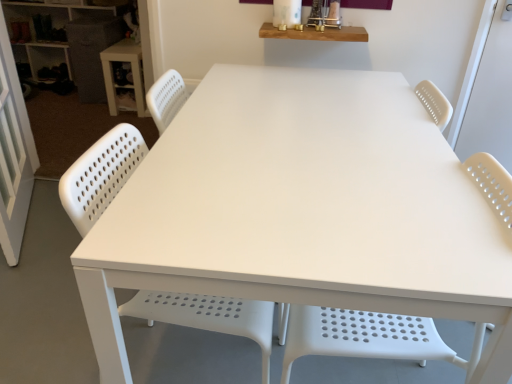
The image size is (512, 384). What do you see at coordinates (132, 74) in the screenshot?
I see `white plastic table at upper left` at bounding box center [132, 74].

The height and width of the screenshot is (384, 512). Describe the element at coordinates (208, 316) in the screenshot. I see `white perforated plastic chair at lower left, the 1th chair from the left` at that location.

This screenshot has width=512, height=384. I want to click on white perforated plastic chair at center, which is the 1th chair from right to left, so click(369, 337).

Image resolution: width=512 pixels, height=384 pixels. In order to click on matte white shelves at upper left in this screenshot , I will do `click(68, 40)`.

Would you say matte white shelves at upper left is a long distance from white plastic table at upper left?

No, there isn't a large distance between matte white shelves at upper left and white plastic table at upper left.

Consider the image. Measure the distance from matte white shelves at upper left to white plastic table at upper left.

A distance of 19.69 inches exists between matte white shelves at upper left and white plastic table at upper left.

From the image's perspective, relative to white plastic table at upper left, is matte white shelves at upper left above or below?

matte white shelves at upper left is situated higher than white plastic table at upper left in the image.

Considering the relative sizes of matte white shelves at upper left and white plastic table at upper left in the image provided, is matte white shelves at upper left shorter than white plastic table at upper left?

In fact, matte white shelves at upper left may be taller than white plastic table at upper left.

Is white plastic table at upper left situated inside white perforated plastic chair at lower left, which is the second chair in right-to-left order, or outside?

white plastic table at upper left is spatially situated outside white perforated plastic chair at lower left, which is the second chair in right-to-left order.

Can you confirm if white plastic table at upper left is smaller than white perforated plastic chair at lower left, which is the second chair in right-to-left order?

Indeed, white plastic table at upper left has a smaller size compared to white perforated plastic chair at lower left, which is the second chair in right-to-left order.

Is white plastic table at upper left looking in the opposite direction of white perforated plastic chair at lower left, the 1th chair from the left?

No.

Who is shorter, white plastic table at upper left or white perforated plastic chair at lower left, the 1th chair from the left?

With less height is white plastic table at upper left.

Which of these two, white plastic table at upper left or white perforated plastic chair at center, which is the 1th chair from right to left, is thinner?

white plastic table at upper left.

How different are the orientations of white plastic table at upper left and white perforated plastic chair at center, which is the 1th chair from right to left, in degrees?

The facing directions of white plastic table at upper left and white perforated plastic chair at center, which is the 1th chair from right to left, are 0.638 degrees apart.

There is a white plastic table at upper left. Identify the location of the 2nd chair above it (from a real-world perspective). This screenshot has height=384, width=512. (369, 337).

Is white perforated plastic chair at center, the 2th chair in the left-to-right sequence, at the back of white plastic table at upper left?

white plastic table at upper left is not turned away from white perforated plastic chair at center, the 2th chair in the left-to-right sequence.

Is matte white shelves at upper left oriented away from white perforated plastic chair at lower left, which is the second chair in right-to-left order?

matte white shelves at upper left is not turned away from white perforated plastic chair at lower left, which is the second chair in right-to-left order.

Can you confirm if matte white shelves at upper left is thinner than white perforated plastic chair at lower left, the 1th chair from the left?

Yes, matte white shelves at upper left is thinner than white perforated plastic chair at lower left, the 1th chair from the left.

Choose the correct answer: Is matte white shelves at upper left inside white perforated plastic chair at lower left, the 1th chair from the left, or outside it?

matte white shelves at upper left is located beyond the bounds of white perforated plastic chair at lower left, the 1th chair from the left.

Between matte white shelves at upper left and white perforated plastic chair at lower left, the 1th chair from the left, which one is positioned behind?

Positioned behind is matte white shelves at upper left.

Considering the relative sizes of white perforated plastic chair at center, the 2th chair in the left-to-right sequence, and matte white shelves at upper left in the image provided, is white perforated plastic chair at center, the 2th chair in the left-to-right sequence, taller than matte white shelves at upper left?

Yes.

Which point is more forward, (409,316) or (90,87)?

The point (409,316) is closer.

Is matte white shelves at upper left at the back of white perforated plastic chair at center, which is the 1th chair from right to left?

No, white perforated plastic chair at center, which is the 1th chair from right to left,'s orientation is not away from matte white shelves at upper left.

Considering the relative positions of white perforated plastic chair at center, the 2th chair in the left-to-right sequence, and matte white shelves at upper left in the image provided, is white perforated plastic chair at center, the 2th chair in the left-to-right sequence, in front of matte white shelves at upper left?

Yes, it is in front of matte white shelves at upper left.

Is matte white shelves at upper left located within white perforated plastic chair at lower left, the 1th chair from the left?

No, matte white shelves at upper left is located outside of white perforated plastic chair at lower left, the 1th chair from the left.

From the image's perspective, is white perforated plastic chair at lower left, the 1th chair from the left, located above or below matte white shelves at upper left?

From the image's perspective, white perforated plastic chair at lower left, the 1th chair from the left, appears below matte white shelves at upper left.

Are white perforated plastic chair at lower left, the 1th chair from the left, and matte white shelves at upper left making contact?

white perforated plastic chair at lower left, the 1th chair from the left, and matte white shelves at upper left are not in contact.

Can you tell me how much white perforated plastic chair at lower left, the 1th chair from the left, and matte white shelves at upper left differ in facing direction?

The facing directions of white perforated plastic chair at lower left, the 1th chair from the left, and matte white shelves at upper left are 89.4 degrees apart.

From the image's perspective, relative to white perforated plastic chair at center, the 2th chair in the left-to-right sequence, is matte white shelves at upper left above or below?

Based on their image positions, matte white shelves at upper left is located above white perforated plastic chair at center, the 2th chair in the left-to-right sequence.

Is matte white shelves at upper left taller than white perforated plastic chair at center, which is the 1th chair from right to left?

No.

Is white perforated plastic chair at center, the 2th chair in the left-to-right sequence, at the back of matte white shelves at upper left?

matte white shelves at upper left is not turned away from white perforated plastic chair at center, the 2th chair in the left-to-right sequence.

Is matte white shelves at upper left bigger or smaller than white perforated plastic chair at center, the 2th chair in the left-to-right sequence?

Considering their sizes, matte white shelves at upper left takes up more space than white perforated plastic chair at center, the 2th chair in the left-to-right sequence.

Where is `table that is in front of the matte white shelves at upper left`? Image resolution: width=512 pixels, height=384 pixels. table that is in front of the matte white shelves at upper left is located at coordinates (132, 74).

The height and width of the screenshot is (384, 512). I want to click on table that is on the left side of white perforated plastic chair at lower left, the 1th chair from the left, so click(132, 74).

Looking at the image, which one is located closer to white perforated plastic chair at center, which is the 1th chair from right to left, white perforated plastic chair at lower left, the 1th chair from the left, or white plastic table at upper left?

Among the two, white perforated plastic chair at lower left, the 1th chair from the left, is located nearer to white perforated plastic chair at center, which is the 1th chair from right to left.

Considering their positions, is white perforated plastic chair at lower left, the 1th chair from the left, positioned closer to matte white shelves at upper left than white perforated plastic chair at center, the 2th chair in the left-to-right sequence?

Based on the image, white perforated plastic chair at lower left, the 1th chair from the left, appears to be nearer to matte white shelves at upper left.

Which object lies nearer to the anchor point white perforated plastic chair at lower left, the 1th chair from the left, white perforated plastic chair at center, which is the 1th chair from right to left, or white plastic table at upper left?

white perforated plastic chair at center, which is the 1th chair from right to left, lies closer to white perforated plastic chair at lower left, the 1th chair from the left, than the other object.

From the image, which object appears to be farther from white perforated plastic chair at center, the 2th chair in the left-to-right sequence, matte white shelves at upper left or white plastic table at upper left?

matte white shelves at upper left is further to white perforated plastic chair at center, the 2th chair in the left-to-right sequence.

Based on their spatial positions, is matte white shelves at upper left or white perforated plastic chair at lower left, the 1th chair from the left, closer to white perforated plastic chair at center, the 2th chair in the left-to-right sequence?

white perforated plastic chair at lower left, the 1th chair from the left.

Estimate the real-world distances between objects in this image. Which object is closer to white perforated plastic chair at lower left, the 1th chair from the left, white plastic table at upper left or white perforated plastic chair at center, the 2th chair in the left-to-right sequence?

white perforated plastic chair at center, the 2th chair in the left-to-right sequence, is closer to white perforated plastic chair at lower left, the 1th chair from the left.

Estimate the real-world distances between objects in this image. Which object is closer to matte white shelves at upper left, white plastic table at upper left or white perforated plastic chair at center, the 2th chair in the left-to-right sequence?

Among the two, white plastic table at upper left is located nearer to matte white shelves at upper left.

From the picture: Considering their positions, is white perforated plastic chair at center, which is the 1th chair from right to left, positioned further to white plastic table at upper left than matte white shelves at upper left?

white perforated plastic chair at center, which is the 1th chair from right to left, lies further to white plastic table at upper left than the other object.

Where is `table located between white perforated plastic chair at lower left, which is the second chair in right-to-left order, and matte white shelves at upper left in the depth direction`? table located between white perforated plastic chair at lower left, which is the second chair in right-to-left order, and matte white shelves at upper left in the depth direction is located at coordinates (132, 74).

At what (x,y) coordinates should I click in order to perform the action: click on chair located between white perforated plastic chair at center, the 2th chair in the left-to-right sequence, and white plastic table at upper left in the depth direction. Please return your answer as a coordinate pair (x, y). Looking at the image, I should click on (208, 316).

Find the location of `table between white perforated plastic chair at center, the 2th chair in the left-to-right sequence, and matte white shelves at upper left, along the z-axis`. table between white perforated plastic chair at center, the 2th chair in the left-to-right sequence, and matte white shelves at upper left, along the z-axis is located at coordinates (132, 74).

Locate an element on the screen. Image resolution: width=512 pixels, height=384 pixels. chair between white perforated plastic chair at center, which is the 1th chair from right to left, and matte white shelves at upper left from front to back is located at coordinates (208, 316).